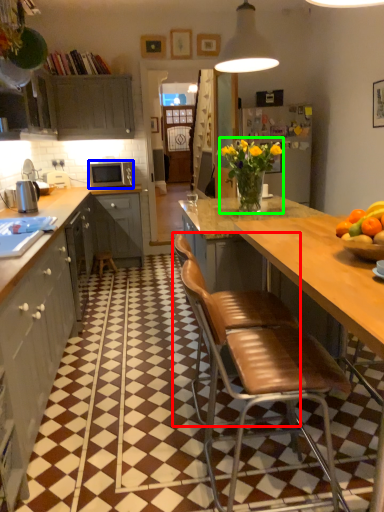
Question: Which is nearer to the chair (highlighted by a red box)? microwave oven (highlighted by a blue box) or floral arrangement (highlighted by a green box).

Choices:
 (A) microwave oven
 (B) floral arrangement

Answer: (B)